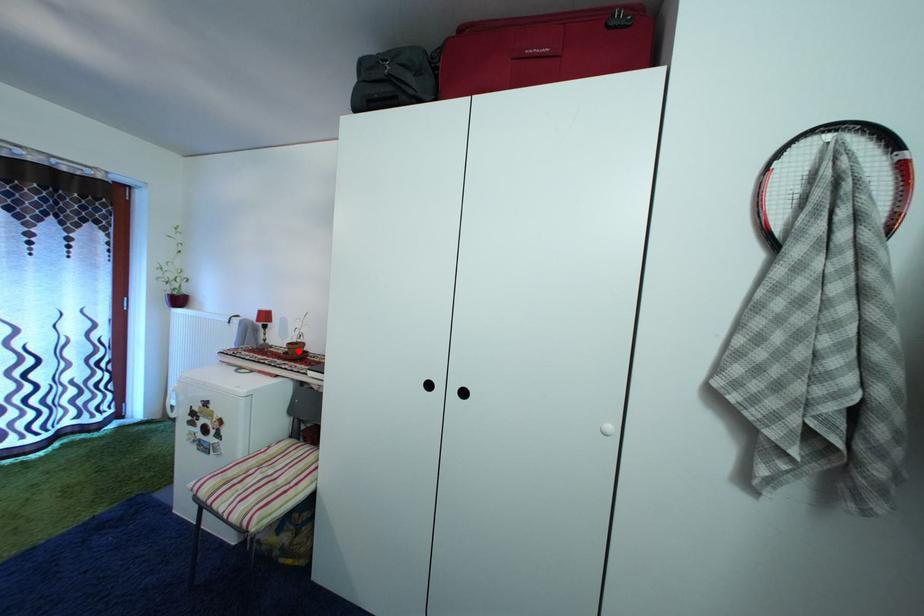
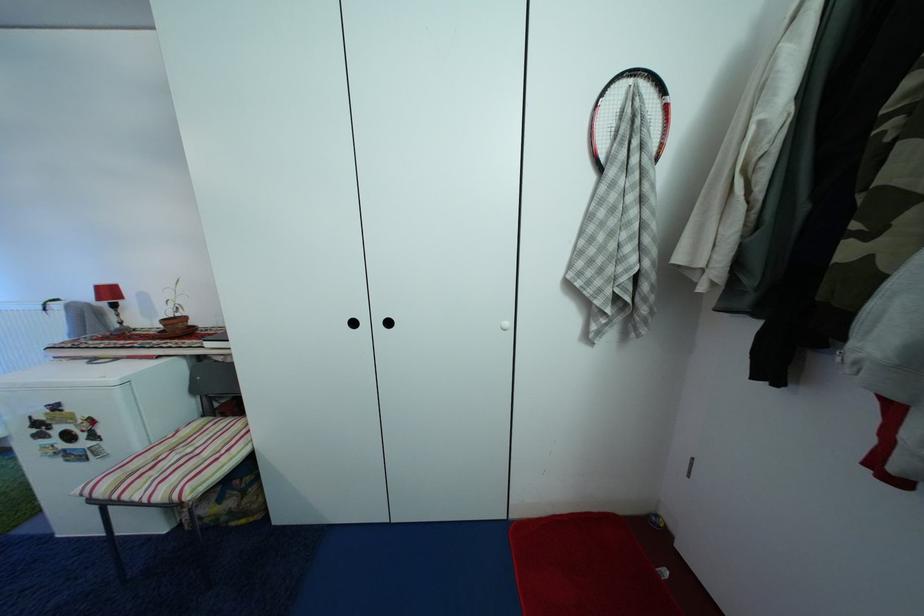
Find the pixel in the second image that matches the highlighted location in the first image.

(174, 326)